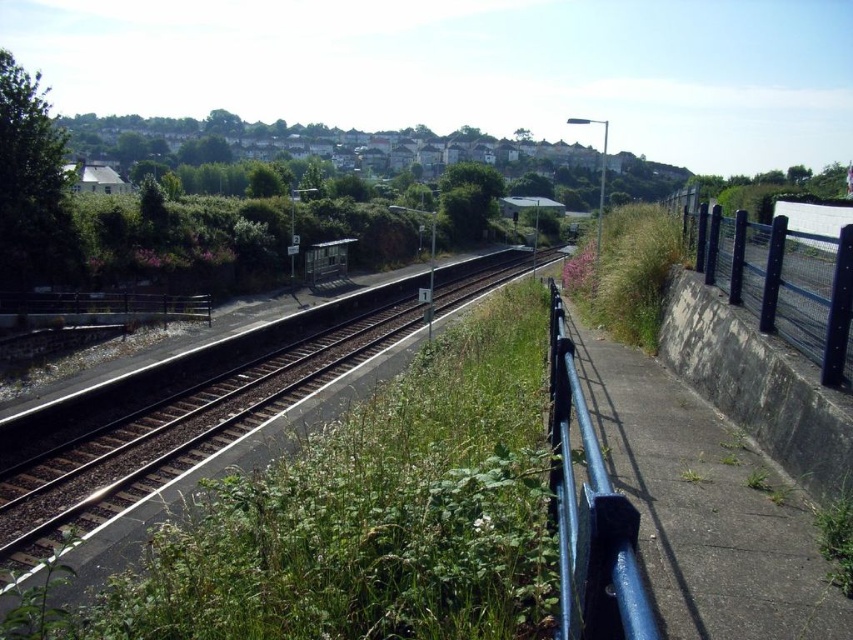
Can you confirm if brown wooden train track at center is wider than black metal fence at right?

Yes.

Is point (357, 358) less distant than point (830, 276)?

No, (357, 358) is further to viewer.

The image size is (853, 640). Describe the element at coordinates (184, 433) in the screenshot. I see `brown wooden train track at center` at that location.

Locate an element on the screen. The image size is (853, 640). brown wooden train track at center is located at coordinates (184, 433).

Does blue metallic rail at right have a lesser width compared to black metal fence at right?

Correct, blue metallic rail at right's width is less than black metal fence at right's.

Between blue metallic rail at right and black metal fence at right, which one is positioned lower?

blue metallic rail at right

Which is behind, point (582, 529) or point (817, 262)?

The point (817, 262) is behind.

Where is `blue metallic rail at right`? blue metallic rail at right is located at coordinates (589, 515).

Measure the distance between brown wooden train track at center and blue metallic rail at right.

brown wooden train track at center is 27.33 meters away from blue metallic rail at right.

Which of these two, brown wooden train track at center or blue metallic rail at right, stands taller?

brown wooden train track at center is taller.

What do you see at coordinates (184, 433) in the screenshot? The height and width of the screenshot is (640, 853). I see `brown wooden train track at center` at bounding box center [184, 433].

The width and height of the screenshot is (853, 640). Find the location of `brown wooden train track at center`. brown wooden train track at center is located at coordinates click(184, 433).